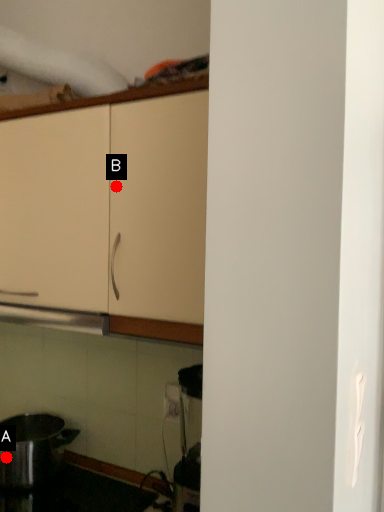
Question: Two points are circled on the image, labeled by A and B beside each circle. Which point appears farthest from the camera in this image?

Choices:
 (A) A is further
 (B) B is further

Answer: (A)